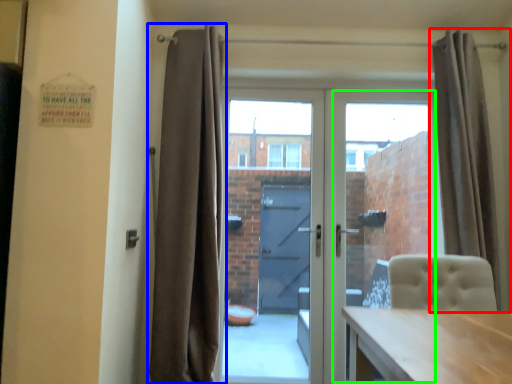
Question: Estimate the real-world distances between objects in this image. Which object is closer to curtain (highlighted by a red box), curtain (highlighted by a blue box) or glass door (highlighted by a green box)?

Choices:
 (A) curtain
 (B) glass door

Answer: (B)